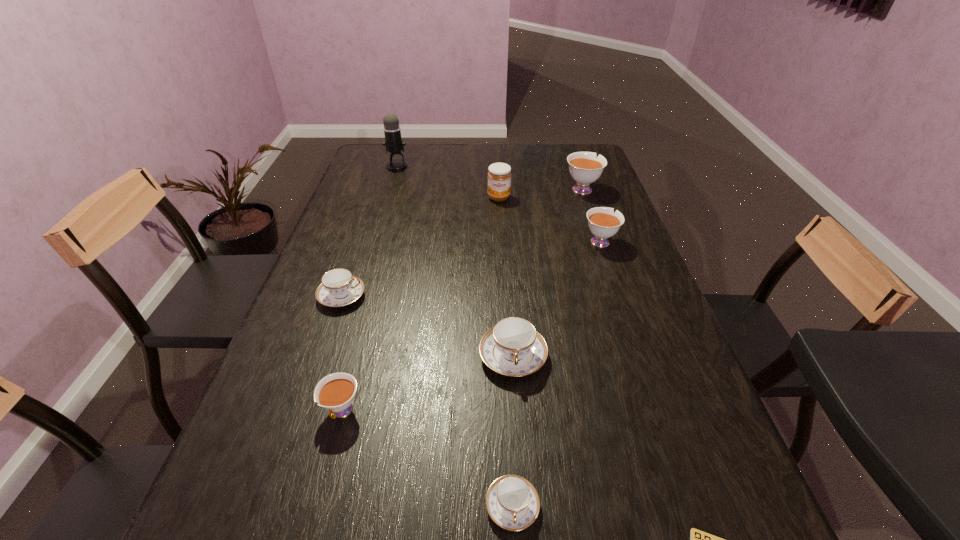
At what (x,y) coordinates should I click in order to perform the action: click on the leftmost white teacup. Please return your answer as a coordinate pair (x, y). Image resolution: width=960 pixels, height=540 pixels. Looking at the image, I should click on (335, 392).

Where is `the farthest blue teacup`? The height and width of the screenshot is (540, 960). the farthest blue teacup is located at coordinates (339, 287).

What are the coordinates of `the fifth farthest object` in the screenshot? It's located at (339, 287).

Where is `the nearest teacup`? the nearest teacup is located at coordinates (512, 502).

Image resolution: width=960 pixels, height=540 pixels. I want to click on the smallest blue teacup, so click(512, 502).

You are a GUI agent. You are given a task and a screenshot of the screen. Output one action in this format:
    pyautogui.click(x=<x>, y=<y>)
    Task: Click on the free space located on the right of the microphone
    The image size is (960, 540).
    Given the screenshot: What is the action you would take?
    pyautogui.click(x=472, y=166)

Locate an element on the screen. vacant space located on the side of the biggest white teacup with the handle is located at coordinates (571, 158).

Identify the location of vacant region located 0.100m on the side of the biggest white teacup with the handle. (573, 165).

You are a GUI agent. You are given a task and a screenshot of the screen. Output one action in this format:
    pyautogui.click(x=<x>, y=<y>)
    Task: Click on the free point located on the side of the biggest white teacup with the handle
    The height and width of the screenshot is (540, 960).
    Given the screenshot: What is the action you would take?
    pyautogui.click(x=570, y=154)

Where is `free space located 0.180m on the front label of the orange jam`? Image resolution: width=960 pixels, height=540 pixels. free space located 0.180m on the front label of the orange jam is located at coordinates (501, 235).